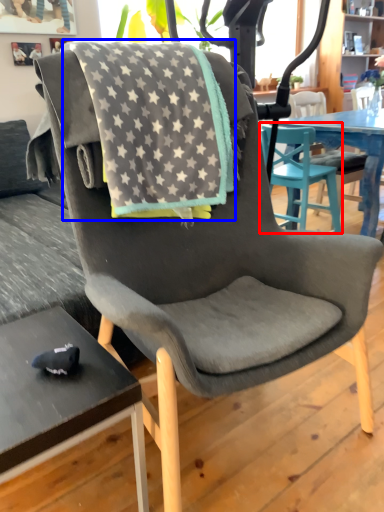
Question: Which object is further to the camera taking this photo, chair (highlighted by a red box) or beach towel (highlighted by a blue box)?

Choices:
 (A) chair
 (B) beach towel

Answer: (A)